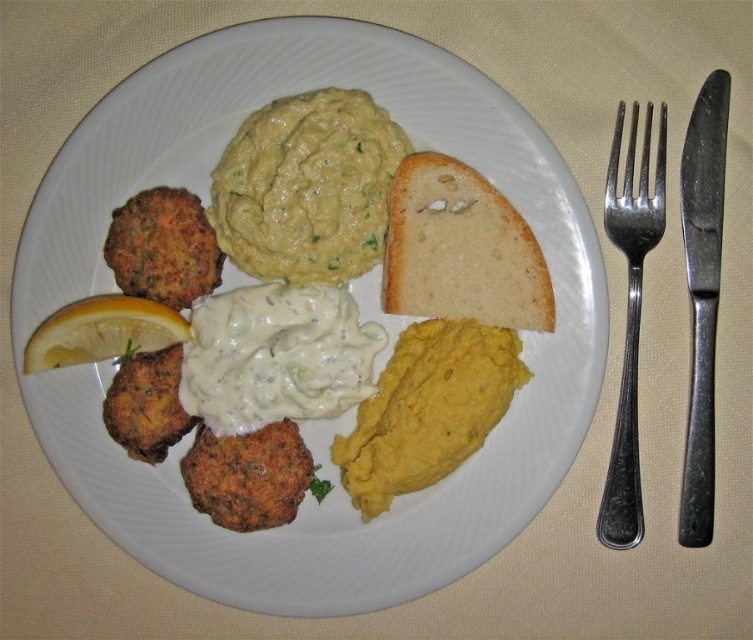
Between white matte bread at upper center and yellow matte lemon at left, which one appears on the right side from the viewer's perspective?

white matte bread at upper center is more to the right.

At what (x,y) coordinates should I click in order to perform the action: click on white matte bread at upper center. Please return your answer as a coordinate pair (x, y). This screenshot has height=640, width=753. Looking at the image, I should click on (459, 250).

Which is more to the right, yellow creamy mashed potato at center or silver metallic fork at upper right?

silver metallic fork at upper right

Which is more to the left, yellow creamy mashed potato at center or silver metallic fork at upper right?

yellow creamy mashed potato at center

Who is more forward, (453, 356) or (630, 452)?

Point (630, 452) is more forward.

You are a GUI agent. You are given a task and a screenshot of the screen. Output one action in this format:
    pyautogui.click(x=<x>, y=<y>)
    Task: Click on the yellow creamy mashed potato at center
    This screenshot has height=640, width=753.
    Given the screenshot: What is the action you would take?
    pyautogui.click(x=427, y=410)

Which is below, yellow creamy mashed potato at center or yellow matte lemon at left?

yellow creamy mashed potato at center is below.

Consider the image. Is yellow creamy mashed potato at center wider than yellow matte lemon at left?

Correct, the width of yellow creamy mashed potato at center exceeds that of yellow matte lemon at left.

Who is more forward, (479, 381) or (41, 348)?

Point (41, 348) is more forward.

I want to click on yellow creamy mashed potato at center, so pyautogui.click(x=427, y=410).